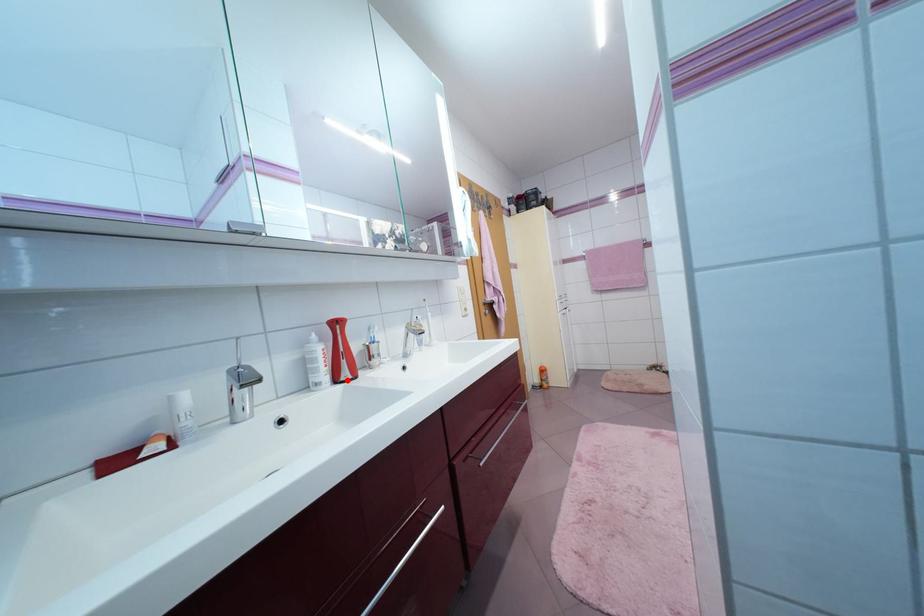
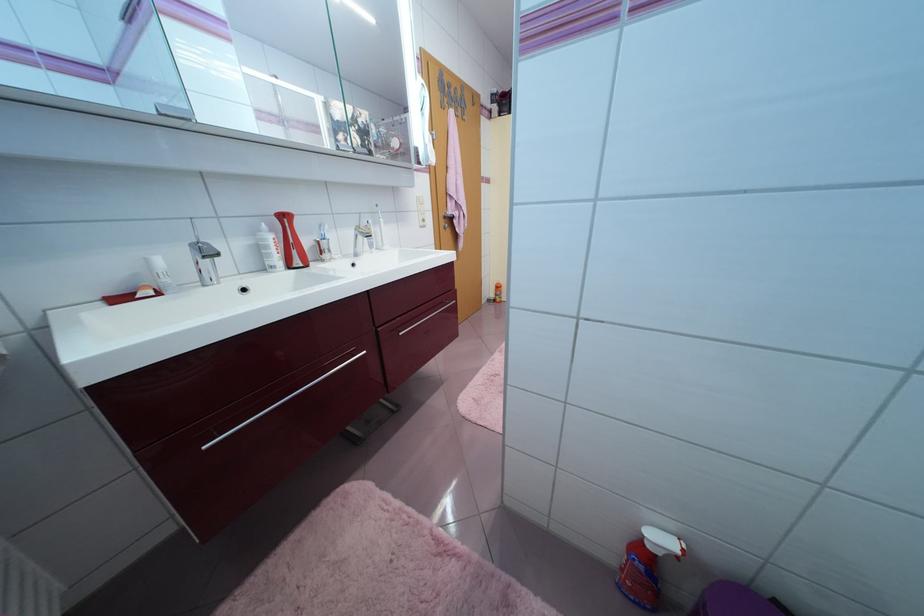
Find the pixel in the second image that matches the highlighted location in the first image.

(299, 267)